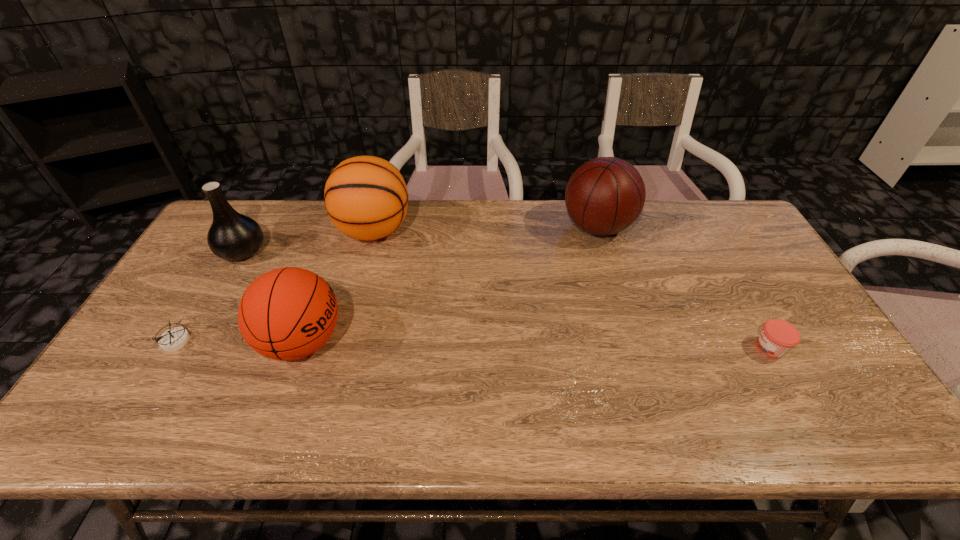
Where is `object that is the fifth closest to the rightmost object`? This screenshot has width=960, height=540. object that is the fifth closest to the rightmost object is located at coordinates (173, 339).

Locate an element on the screen. The height and width of the screenshot is (540, 960). the second closest basketball relative to the vase is located at coordinates (366, 198).

This screenshot has height=540, width=960. Find the location of `basketball identified as the closest to the nearest basketball`. basketball identified as the closest to the nearest basketball is located at coordinates (366, 198).

Find the location of `vacant point that satisfies the following two spatial constraints: 1. on the front side of the rightmost basketball; 2. on the side with logo of the nearest basketball`. vacant point that satisfies the following two spatial constraints: 1. on the front side of the rightmost basketball; 2. on the side with logo of the nearest basketball is located at coordinates (632, 342).

The width and height of the screenshot is (960, 540). What are the coordinates of `vacant point that satisfies the following two spatial constraints: 1. on the back side of the vase; 2. on the right side of the rightmost basketball` in the screenshot? It's located at (256, 227).